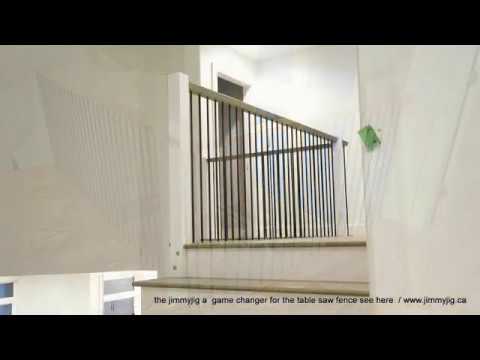
The image size is (480, 360). Identify the location of top narrow window. (117, 289), (4, 290).